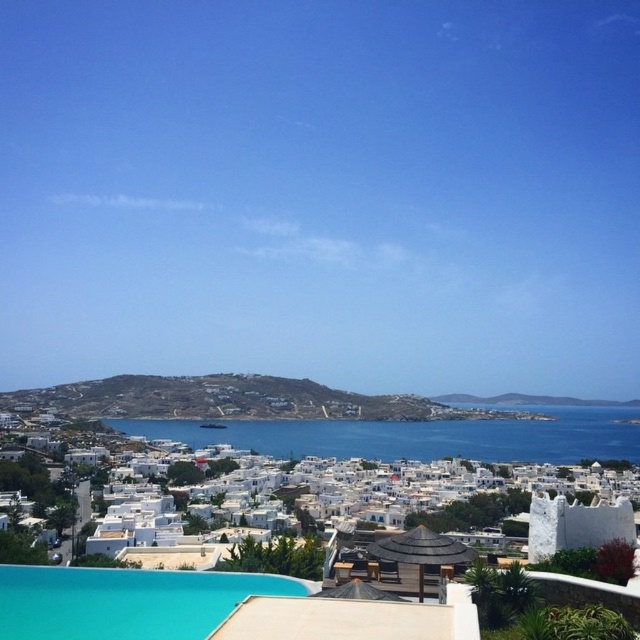
Is blue water at center in front of turquoise glossy pool at lower center?

No, it is not.

Is point (531, 433) closer to camera compared to point (24, 579)?

No.

Is point (467, 452) closer to camera compared to point (0, 604)?

No, it is behind (0, 604).

Identify the location of blue water at center. (419, 436).